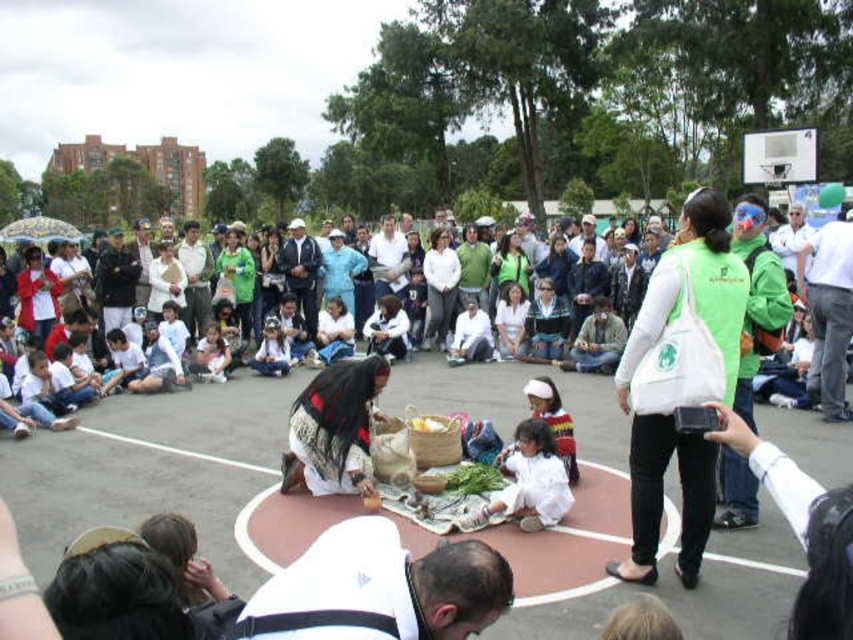
You are a photographer trying to capture the scene of the group around the performers. You notice the white woven blanket at center and the white fabric shirt at lower center. Since both are white, could the blanket potentially cover part of the shirt in your photo?

Yes, the white woven blanket at center is positioned over the white fabric shirt at lower center, so it could cover part of the shirt in the photo.

You are standing at the point labeled point (715, 227) and want to walk to the basketball court located at the center of the image. If you walk straight ahead, will you pass by the point labeled point (714, 586)?

Yes, since point (714, 586) is in front of point (715, 227), walking straight towards the basketball court would pass by point (714, 586) first before reaching the court.

You are standing at the edge of the basketball court and want to place a small picnic basket on the white fabric blanket at center. The point you are aiming for is at coordinates point (570, 541). Is this point on the white fabric blanket at center?

Yes, the point (570, 541) is on the white fabric blanket at center, so placing the picnic basket there would be appropriate.